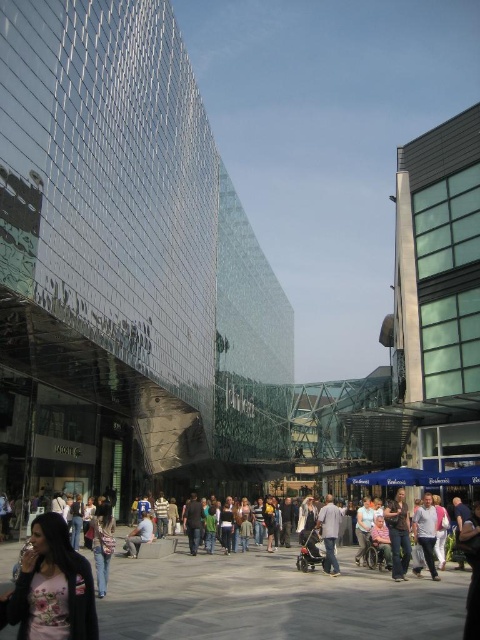
Does floral fabric shirt at lower left appear over light gray fabric jacket at center?

Indeed, floral fabric shirt at lower left is positioned over light gray fabric jacket at center.

Can you confirm if floral fabric shirt at lower left is positioned below light gray fabric jacket at center?

No.

Who is more distant from viewer, (75, 573) or (317, 520)?

The point (317, 520) is more distant.

I want to click on floral fabric shirt at lower left, so [52, 586].

In the scene shown: Which of these two, light brown leather jacket at center or light gray fabric jacket at center, stands taller?

With more height is light gray fabric jacket at center.

Is the position of light brown leather jacket at center less distant than that of light gray fabric jacket at center?

Yes, it is in front of light gray fabric jacket at center.

Image resolution: width=480 pixels, height=640 pixels. I want to click on light brown leather jacket at center, so click(398, 534).

I want to click on light brown leather jacket at center, so click(x=398, y=534).

Can you confirm if light gray fabric jacket at center is shorter than light blue jeans at center?

No.

Which is in front, point (325, 550) or point (128, 540)?

Point (325, 550) is in front.

At what (x,y) coordinates should I click in order to perform the action: click on light gray fabric jacket at center. Please return your answer as a coordinate pair (x, y). This screenshot has width=480, height=640. Looking at the image, I should click on (330, 532).